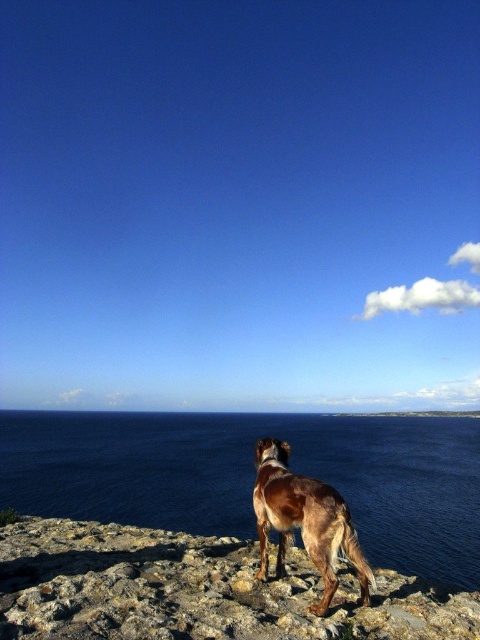
Question: Is blue water at lower center thinner than brown speckled fur dog at center?

Choices:
 (A) no
 (B) yes

Answer: (A)

Question: Which of the following is the farthest from the observer?

Choices:
 (A) (330, 476)
 (B) (310, 545)

Answer: (A)

Question: Is blue water at lower center closer to camera compared to brown speckled fur dog at center?

Choices:
 (A) no
 (B) yes

Answer: (A)

Question: Which object appears farthest from the camera in this image?

Choices:
 (A) brown speckled fur dog at center
 (B) blue water at lower center

Answer: (B)

Question: Which point is closer to the camera taking this photo?

Choices:
 (A) click(325, 593)
 (B) click(99, 460)

Answer: (A)

Question: Is blue water at lower center thinner than brown speckled fur dog at center?

Choices:
 (A) yes
 (B) no

Answer: (B)